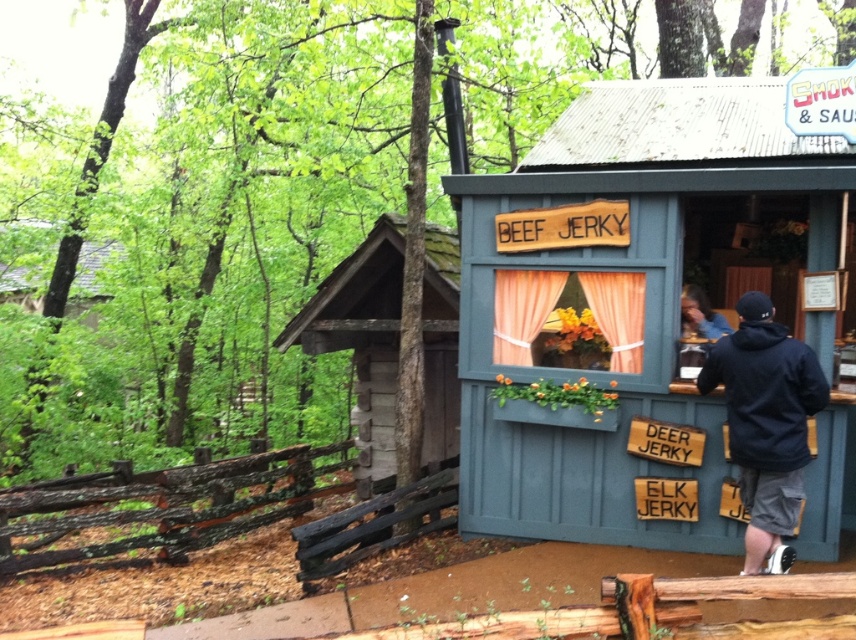
Is rustic wood cabin at left further to the viewer compared to black fabric jacket at right?

Yes, it is.

Who is taller, rustic wood cabin at left or black fabric jacket at right?

Standing taller between the two is rustic wood cabin at left.

I want to click on rustic wood cabin at left, so click(x=361, y=339).

In order to click on rustic wood cabin at left in this screenshot , I will do `click(361, 339)`.

Who is lower down, teal wooden cabin at center or rustic wood cabin at left?

Positioned lower is rustic wood cabin at left.

I want to click on teal wooden cabin at center, so click(x=638, y=285).

Is point (664, 289) positioned behind point (367, 432)?

No, it is in front of (367, 432).

This screenshot has width=856, height=640. I want to click on teal wooden cabin at center, so click(638, 285).

Looking at this image, is teal wooden cabin at center to the left of black fabric jacket at right from the viewer's perspective?

Yes, teal wooden cabin at center is to the left of black fabric jacket at right.

Does teal wooden cabin at center appear under black fabric jacket at right?

Incorrect, teal wooden cabin at center is not positioned below black fabric jacket at right.

Is point (642, 116) closer to camera compared to point (749, 412)?

No.

Where is `teal wooden cabin at center`? The height and width of the screenshot is (640, 856). teal wooden cabin at center is located at coordinates (638, 285).